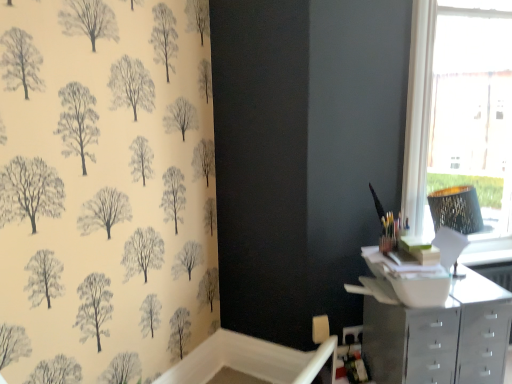
Question: Is the surface of metallic silver chest of drawers at lower right in direct contact with white frame at upper right?

Choices:
 (A) no
 (B) yes

Answer: (A)

Question: Could you tell me if metallic silver chest of drawers at lower right is turned towards white frame at upper right?

Choices:
 (A) no
 (B) yes

Answer: (A)

Question: Does metallic silver chest of drawers at lower right appear on the right side of white frame at upper right?

Choices:
 (A) yes
 (B) no

Answer: (B)

Question: From the image's perspective, is metallic silver chest of drawers at lower right over white frame at upper right?

Choices:
 (A) no
 (B) yes

Answer: (A)

Question: Considering the relative sizes of metallic silver chest of drawers at lower right and white frame at upper right in the image provided, is metallic silver chest of drawers at lower right shorter than white frame at upper right?

Choices:
 (A) yes
 (B) no

Answer: (A)

Question: From a real-world perspective, is white frame at upper right above or below metallic silver chest of drawers at lower right?

Choices:
 (A) below
 (B) above

Answer: (B)

Question: Is white frame at upper right spatially inside metallic silver chest of drawers at lower right, or outside of it?

Choices:
 (A) outside
 (B) inside

Answer: (A)

Question: Is white frame at upper right bigger or smaller than metallic silver chest of drawers at lower right?

Choices:
 (A) small
 (B) big

Answer: (B)

Question: Is white frame at upper right taller or shorter than metallic silver chest of drawers at lower right?

Choices:
 (A) short
 (B) tall

Answer: (B)

Question: Would you say white glossy file cabinet at lower right is inside or outside metallic silver chest of drawers at lower right?

Choices:
 (A) outside
 (B) inside

Answer: (A)

Question: From the image's perspective, relative to metallic silver chest of drawers at lower right, is white glossy file cabinet at lower right above or below?

Choices:
 (A) above
 (B) below

Answer: (B)

Question: Visually, is white glossy file cabinet at lower right positioned to the left or to the right of metallic silver chest of drawers at lower right?

Choices:
 (A) right
 (B) left

Answer: (B)

Question: From a real-world perspective, is white glossy file cabinet at lower right physically located above or below metallic silver chest of drawers at lower right?

Choices:
 (A) above
 (B) below

Answer: (B)

Question: Is white frame at upper right to the left or to the right of white glossy file cabinet at lower right in the image?

Choices:
 (A) right
 (B) left

Answer: (A)

Question: In terms of size, does white frame at upper right appear bigger or smaller than white glossy file cabinet at lower right?

Choices:
 (A) big
 (B) small

Answer: (A)